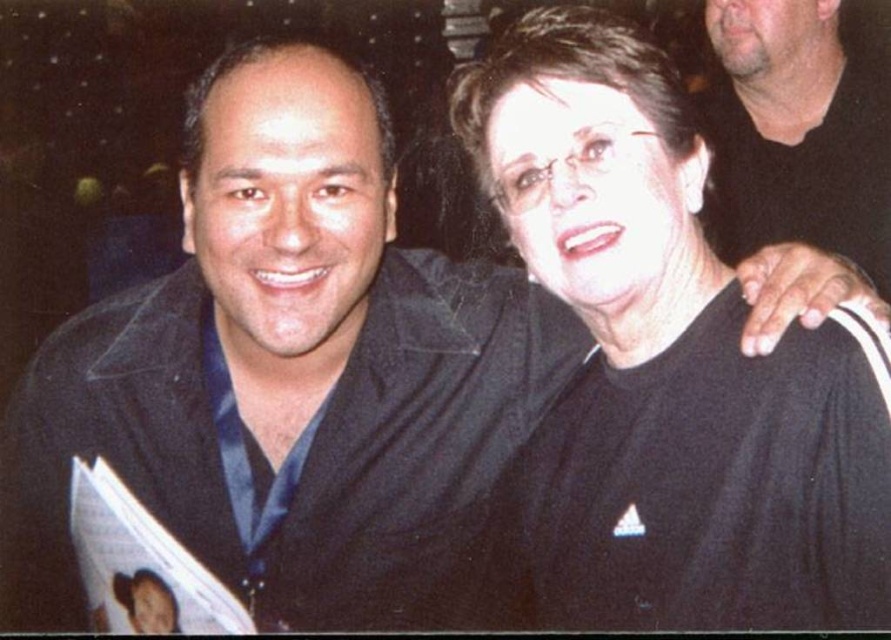
Based on the scene described, which object from the list has a greater height? Please refer to the objects listed below and choose between them. Objects to consider are black matte shirt at center and dark gray shirt at upper right.

The black matte shirt at center has a greater height compared to the dark gray shirt at upper right.

You are taking a photo and want to ensure both the black matte shirt at center and the dark gray shirt at upper right are clearly visible. Which shirt should you adjust to avoid blocking the other?

The black matte shirt at center is to the left of the dark gray shirt at upper right. To avoid blocking, move the dark gray shirt at upper right further to the right or the black matte shirt at center further to the left.